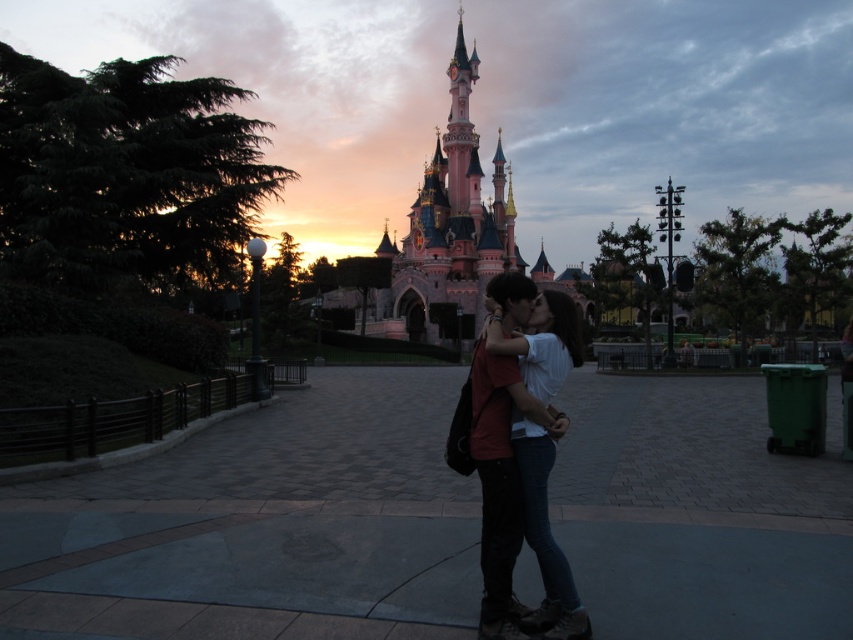
Consider the image. You are a photographer planning to take a photo of the matte black couple at center and the pink painted stone castle at center. Given that the camera you are using has a limited field of view, which object should you focus on to ensure both are visible in the frame?

The matte black couple at center has a lesser width compared to the pink painted stone castle at center. To fit both in the frame, focus on the wider object, the pink painted stone castle at center, and adjust the camera angle to include the narrower matte black couple at center.

You are a photographer at Disneyland Paris trying to capture the iconic Sleeping Beauty Castle. You notice a couple in front of the castle. Based on the scene, is the matte black couple at center blocking your view of the pink painted stone castle at center?

The matte black couple at center is to the right of the pink painted stone castle at center, so they are not blocking the view of the castle.

Consider the image. You are planning to take a photo of the matte black couple at center and the pink painted stone castle at center at Disneyland Paris. Based on their sizes, which one should you focus on to ensure both are visible in the frame?

Since the matte black couple at center is smaller than the pink painted stone castle at center, you should focus on the pink painted stone castle at center to ensure both are visible in the frame.